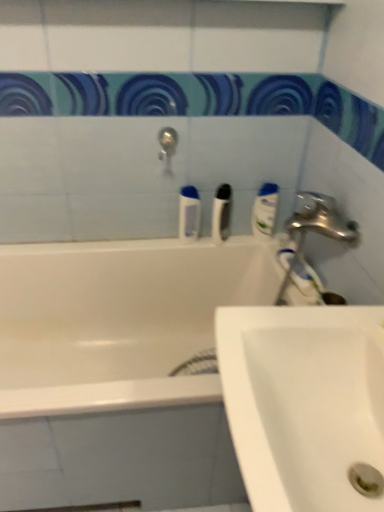
Question: From a real-world perspective, is white ceramic sink at lower right above or below white glossy mouthwash at upper right, which ranks as the first mouthwash in right-to-left order?

Choices:
 (A) below
 (B) above

Answer: (B)

Question: Based on their positions, is white ceramic sink at lower right located to the left or right of white glossy mouthwash at upper right, acting as the second mouthwash starting from the left?

Choices:
 (A) left
 (B) right

Answer: (A)

Question: Estimate the real-world distances between objects in this image. Which object is farther from the white glossy bathtub at upper center?

Choices:
 (A) white glossy mouthwash at upper right, acting as the second mouthwash starting from the left
 (B) white ceramic sink at lower right
 (C) white plastic toothbrush at center
 (D) silver metallic tap at upper center
 (E) white glossy toothpaste at right

Answer: (B)

Question: Which is nearer to the white glossy bathtub at center?

Choices:
 (A) white plastic toothbrush at center
 (B) white glossy toothpaste at right
 (C) silver metallic tap at upper center
 (D) blue glossy mouthwash at center, the second mouthwash viewed from the right
 (E) white glossy bathtub at upper center

Answer: (E)